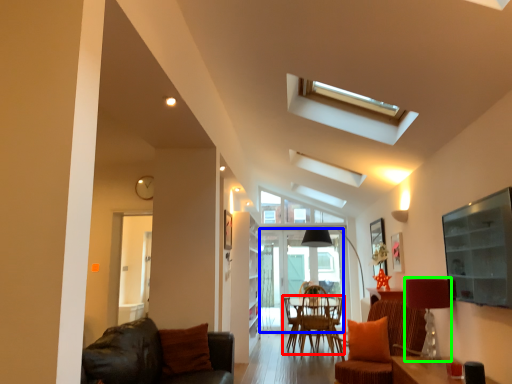
Question: Based on their relative distances, which object is farther from chair (highlighted by a red box)? Choose from glass door (highlighted by a blue box) and lamp (highlighted by a green box).

Choices:
 (A) glass door
 (B) lamp

Answer: (B)